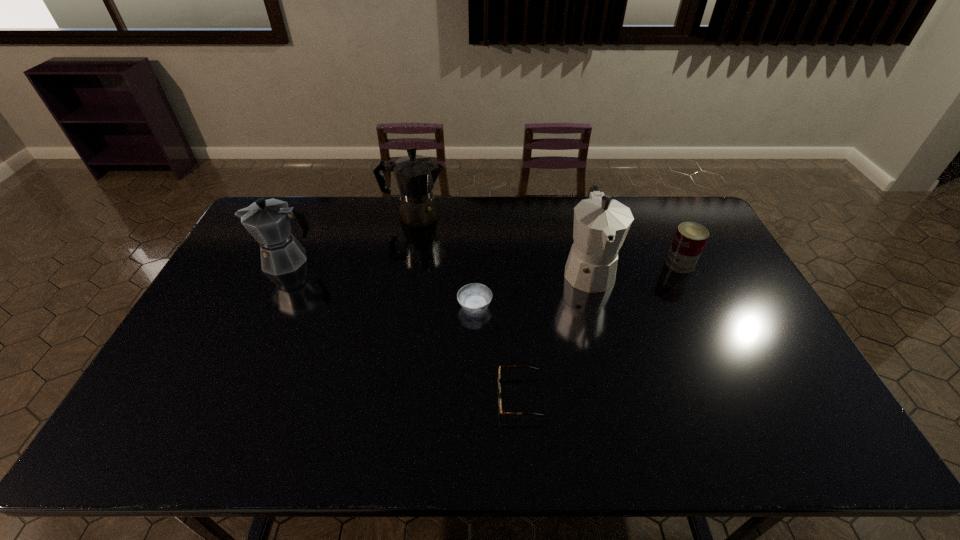
The height and width of the screenshot is (540, 960). I want to click on vacant area between the fifth object from left to right and the can, so click(634, 267).

Identify the location of empty space that is in between the rightmost object and the second coffeepot from right to left. Image resolution: width=960 pixels, height=540 pixels. (547, 240).

Where is `unoccupied area between the nearest object and the third tallest object`? This screenshot has height=540, width=960. unoccupied area between the nearest object and the third tallest object is located at coordinates (403, 328).

This screenshot has width=960, height=540. Find the location of `empty space between the second coffeepot from right to left and the can`. empty space between the second coffeepot from right to left and the can is located at coordinates (547, 240).

The image size is (960, 540). Identify the location of vacant space that's between the nearest object and the third tallest object. (403, 328).

The height and width of the screenshot is (540, 960). What are the coordinates of `object that is the fourth closest to the can` in the screenshot? It's located at (415, 175).

Locate an element on the screen. object that stands as the fifth closest to the farthest coffeepot is located at coordinates (690, 238).

Choose which coffeepot is the second nearest neighbor to the farthest coffeepot. Please provide its 2D coordinates. Your answer should be formatted as a tuple, i.e. [(x, y)], where the tuple contains the x and y coordinates of a point satisfying the conditions above.

[(601, 224)]

Locate which coffeepot is the third closest to the can. Please provide its 2D coordinates. Your answer should be formatted as a tuple, i.e. [(x, y)], where the tuple contains the x and y coordinates of a point satisfying the conditions above.

[(268, 221)]

The width and height of the screenshot is (960, 540). I want to click on vacant region that satisfies the following two spatial constraints: 1. on the pouring side of the fifth object from right to left; 2. on the right side of the ashtray, so click(398, 306).